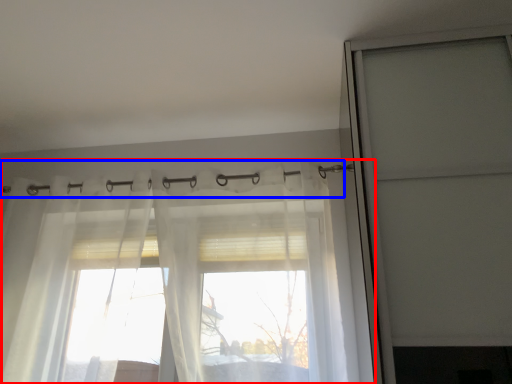
Question: Which of the following is the closest to the observer, curtain (highlighted by a red box) or clothesline (highlighted by a blue box)?

Choices:
 (A) curtain
 (B) clothesline

Answer: (A)